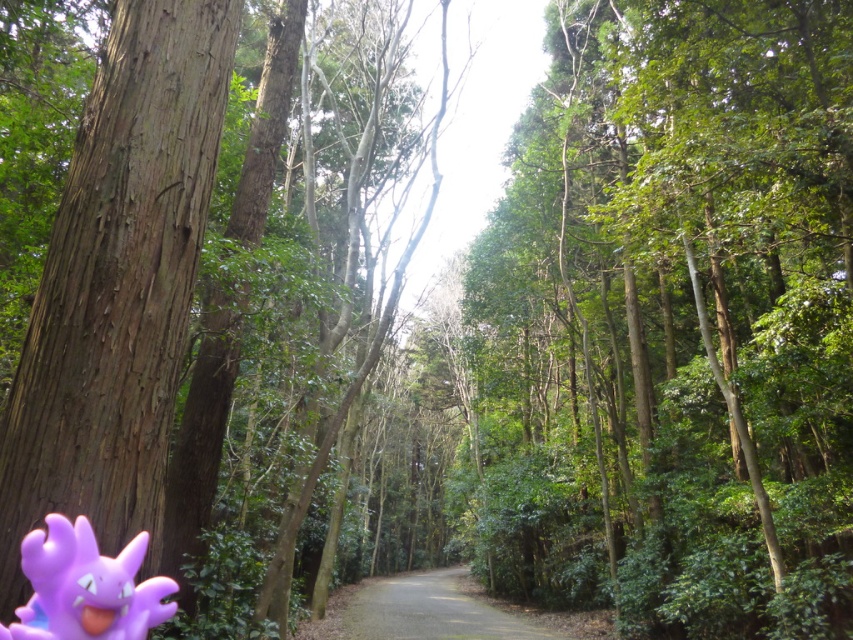
Question: Does purple rubber toy at lower left appear over gravel road at center?

Choices:
 (A) no
 (B) yes

Answer: (B)

Question: Does purple rubber toy at lower left come in front of gravel road at center?

Choices:
 (A) yes
 (B) no

Answer: (A)

Question: Is purple rubber toy at lower left below gravel road at center?

Choices:
 (A) no
 (B) yes

Answer: (A)

Question: Which of the following is the closest to the observer?

Choices:
 (A) (341, 632)
 (B) (137, 614)

Answer: (B)